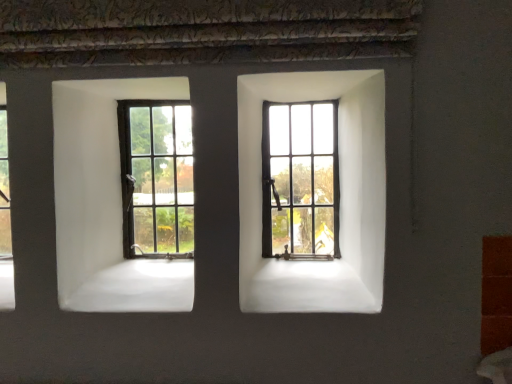
The width and height of the screenshot is (512, 384). I want to click on free space in front of matte black window at center, placed as the 2th window when sorted from left to right, so click(x=304, y=266).